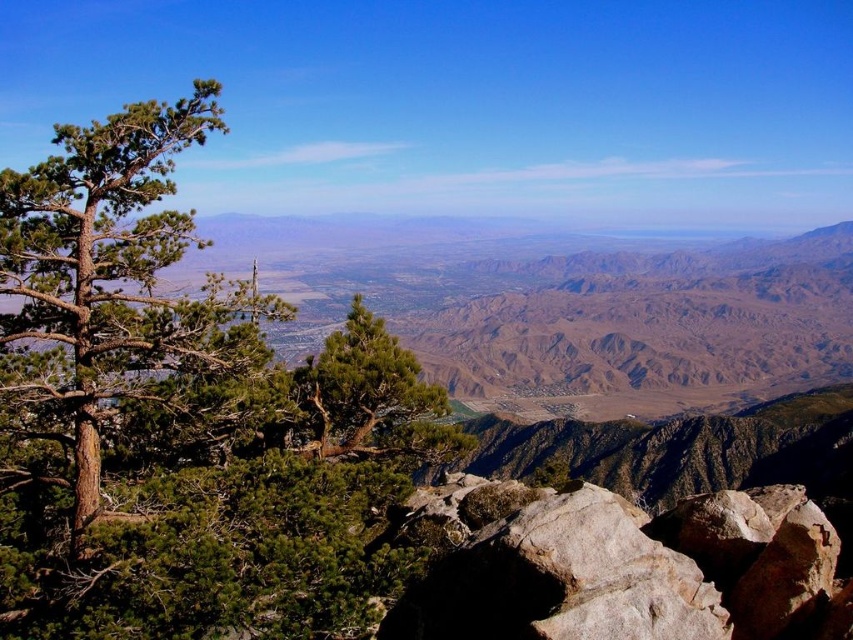
You are planning to place a small garden statue that is 1 meter wide between the green rough bark tree at left and the gray rough rock at lower right. Based on their widths, will there be enough space between them to fit the statue?

The green rough bark tree at left has a lesser width compared to gray rough rock at lower right. Since the statue is 1 meter wide, we need to know the actual widths of both objects to determine if there is enough space. However, the description only states that the tree is narrower than the rock, but not their exact measurements. Therefore, it is uncertain if the space between them can accommodate the statue without more specific information.